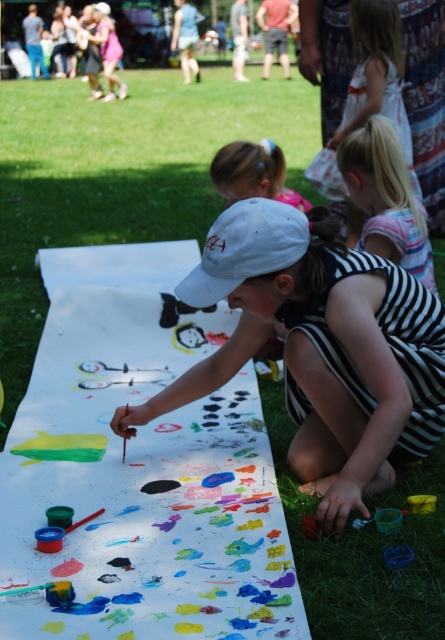
Does white striped dress at center lie behind white matte baseball cap at center?

Yes, it is behind white matte baseball cap at center.

This screenshot has height=640, width=445. What do you see at coordinates (359, 65) in the screenshot? I see `white striped dress at center` at bounding box center [359, 65].

You are a GUI agent. You are given a task and a screenshot of the screen. Output one action in this format:
    pyautogui.click(x=<x>, y=<y>)
    Task: Click on the white striped dress at center
    This screenshot has height=640, width=445.
    Given the screenshot: What is the action you would take?
    pos(359,65)

Can you confirm if green grass at lower center is shorter than striped fabric dress at center?

Incorrect, green grass at lower center's height does not fall short of striped fabric dress at center's.

Can you confirm if green grass at lower center is positioned to the right of striped fabric dress at center?

Incorrect, green grass at lower center is not on the right side of striped fabric dress at center.

This screenshot has height=640, width=445. In order to click on green grass at lower center in this screenshot , I will do `click(122, 176)`.

Does white matte cap at center lie behind white striped dress at center?

No, white matte cap at center is closer to the viewer.

Is white matte cap at center positioned in front of white striped dress at center?

Yes, it is in front of white striped dress at center.

What do you see at coordinates (319, 346) in the screenshot?
I see `white matte cap at center` at bounding box center [319, 346].

Find the location of a particular element. white matte cap at center is located at coordinates (319, 346).